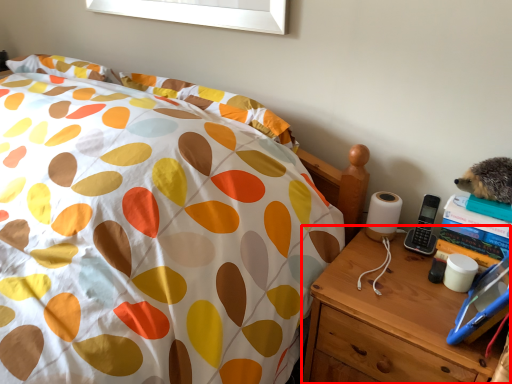
Question: From the image's perspective, where is nightstand (annotated by the red box) located relative to bed?

Choices:
 (A) above
 (B) below

Answer: (B)